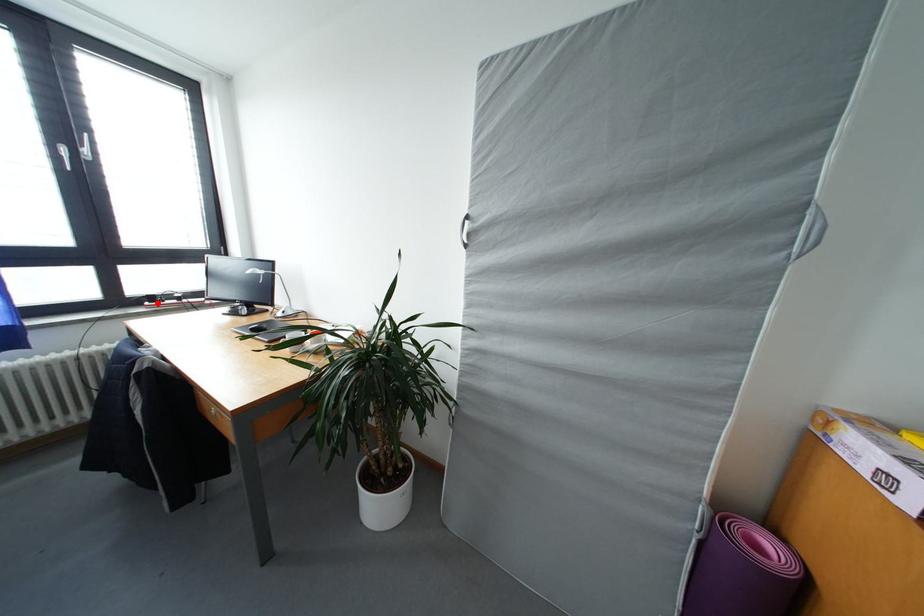
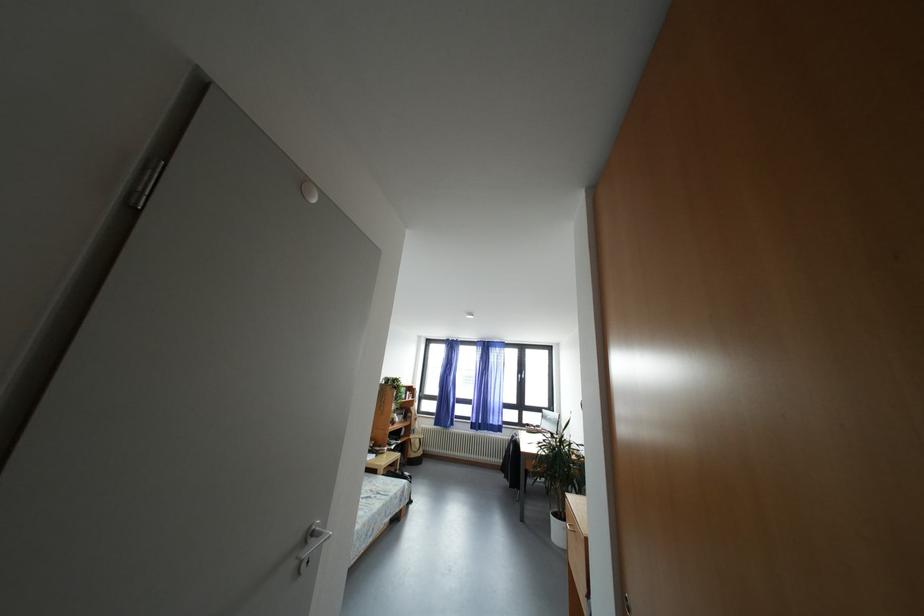
In the second image, find the point that corresponds to the highlighted location in the first image.

(533, 430)